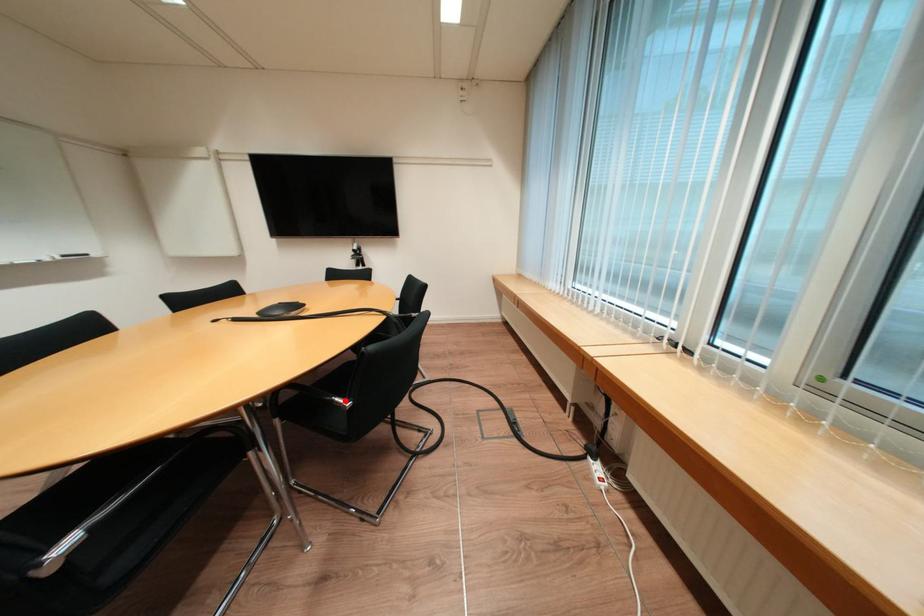
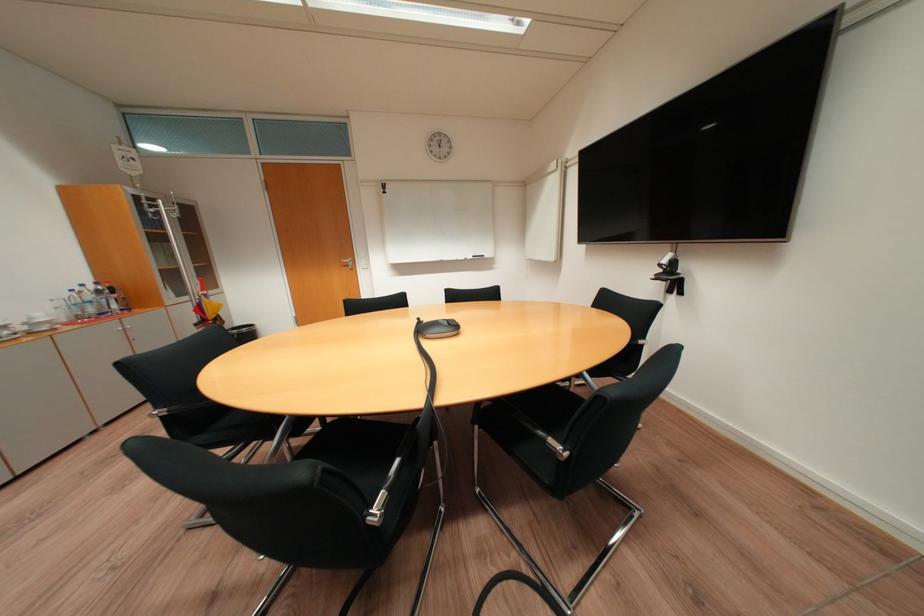
Question: I am providing you with two images of the same scene from different viewpoints. A red point is marked on the first image. Can you still see the location of the red point in image 2?

Choices:
 (A) Yes
 (B) No

Answer: (B)